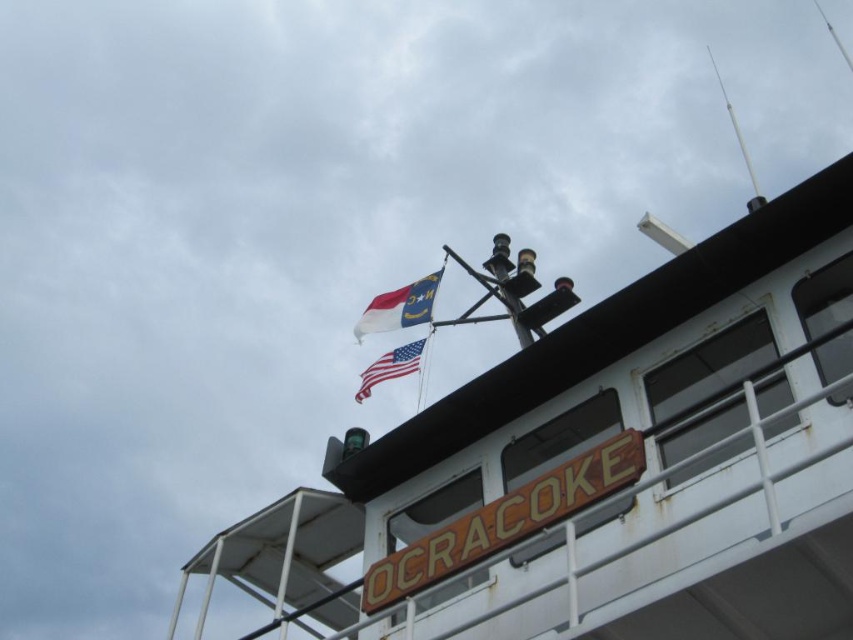
Between point (467, 576) and point (364, 378), which one is positioned in front?

Point (467, 576) is more forward.

Measure the distance between white matte boat at upper center and american flag at upper center.

white matte boat at upper center and american flag at upper center are 25.42 meters apart from each other.

Between point (589, 330) and point (422, 344), which one is positioned in front?

Positioned in front is point (589, 330).

Where is `white matte boat at upper center`? white matte boat at upper center is located at coordinates (605, 467).

Which is above, matte plastic flag at upper center or american flag at upper center?

Positioned higher is matte plastic flag at upper center.

Is matte plastic flag at upper center to the right of american flag at upper center from the viewer's perspective?

In fact, matte plastic flag at upper center is to the left of american flag at upper center.

Does point (376, 301) come farther from viewer compared to point (375, 368)?

Yes, it is.

I want to click on matte plastic flag at upper center, so (x=399, y=307).

How distant is white matte boat at upper center from matte plastic flag at upper center?

white matte boat at upper center is 29.10 meters from matte plastic flag at upper center.

Which is more to the right, white matte boat at upper center or matte plastic flag at upper center?

matte plastic flag at upper center is more to the right.

Where is `white matte boat at upper center`? The height and width of the screenshot is (640, 853). white matte boat at upper center is located at coordinates (605, 467).